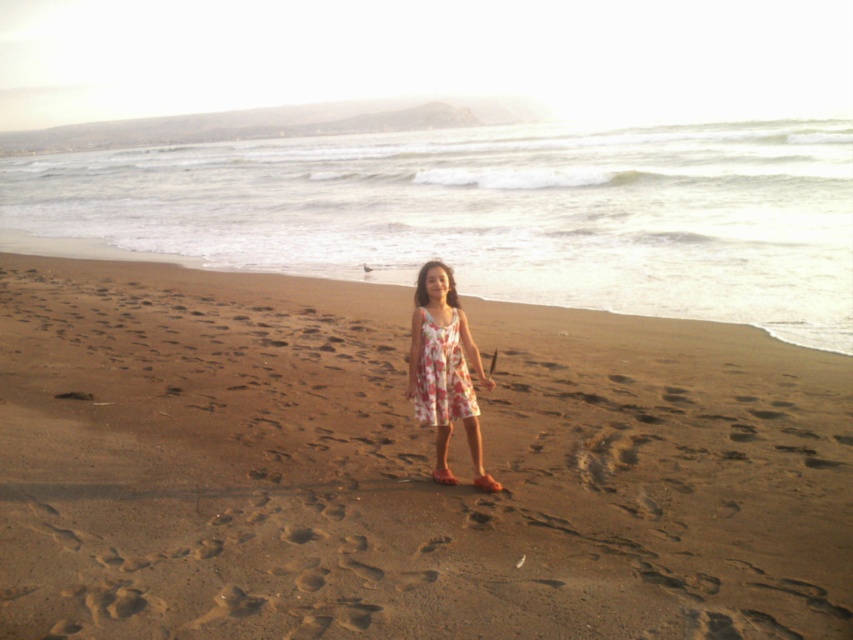
You are a photographer trying to capture the entire scene of the brown sandy beach at center and the floral fabric dress at center in one shot. Considering their sizes, which object will occupy more of the frame?

The brown sandy beach at center is larger in size than the floral fabric dress at center, so it will occupy more of the frame.

You are a photographer planning to capture a wide shot of the scene. Given that the brown sandy beach at center and the floral cotton dress at center are both in the frame, which object would occupy more space in the photo?

The brown sandy beach at center would occupy more space in the photo since it is bigger than the floral cotton dress at center.